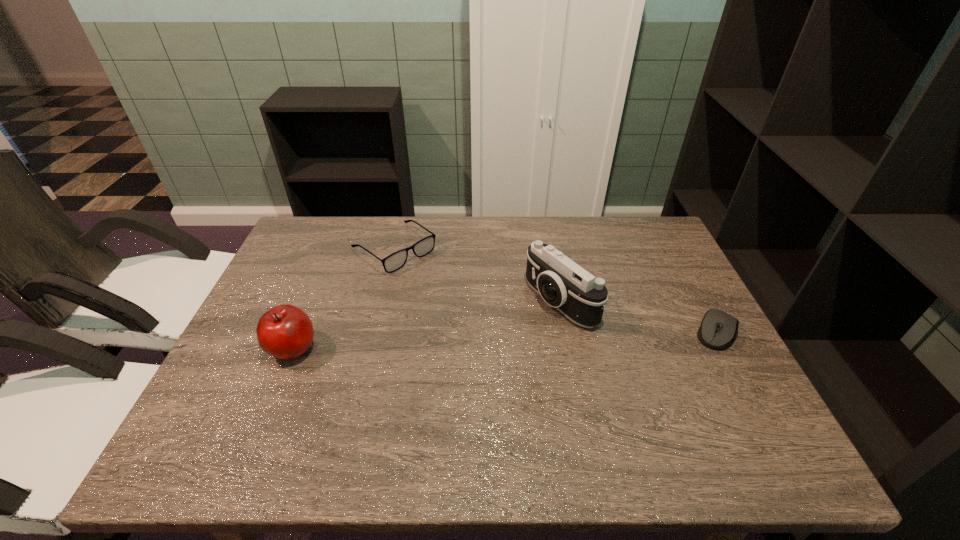
Image resolution: width=960 pixels, height=540 pixels. In order to click on free location at the far right corner in this screenshot , I will do `click(654, 225)`.

Where is `free space at the near right corner of the desktop`? This screenshot has height=540, width=960. free space at the near right corner of the desktop is located at coordinates (707, 390).

Locate an element on the screen. unoccupied position between the second tallest object and the third object from left to right is located at coordinates (426, 325).

The width and height of the screenshot is (960, 540). In order to click on free space that is in between the computer equipment and the second object from right to left in this screenshot , I will do (x=639, y=317).

At what (x,y) coordinates should I click in order to perform the action: click on vacant space that's between the third tallest object and the camera. Please return your answer as a coordinate pair (x, y). The width and height of the screenshot is (960, 540). Looking at the image, I should click on (477, 275).

Find the location of a particular element. This screenshot has width=960, height=540. free space between the spectacles and the third shortest object is located at coordinates (344, 298).

I want to click on vacant area that lies between the second object from right to left and the second tallest object, so click(x=426, y=325).

Where is `vacant region between the apple and the computer equipment`? The width and height of the screenshot is (960, 540). vacant region between the apple and the computer equipment is located at coordinates (505, 340).

Locate an element on the screen. The width and height of the screenshot is (960, 540). free spot between the apple and the camera is located at coordinates (426, 325).

You are a GUI agent. You are given a task and a screenshot of the screen. Output one action in this format:
    pyautogui.click(x=<x>, y=<y>)
    Task: Click on the empty space between the apple and the spectacles
    This screenshot has width=960, height=540.
    Given the screenshot: What is the action you would take?
    pyautogui.click(x=344, y=298)